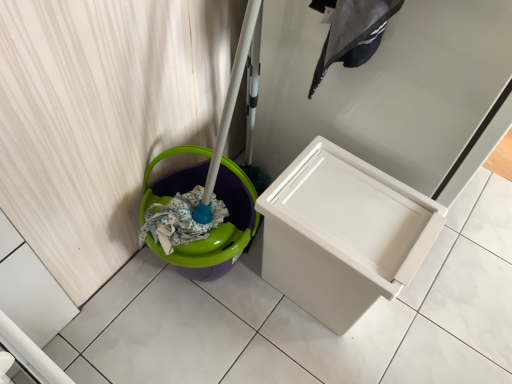
Locate an element on the screen. This screenshot has height=384, width=512. vacant area to the right of white plastic waste container at center is located at coordinates (424, 320).